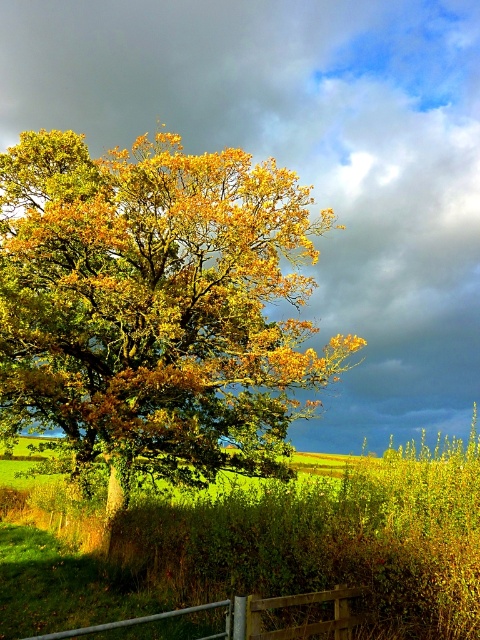
What do you see at coordinates (156, 307) in the screenshot?
I see `golden yellow leaves at center` at bounding box center [156, 307].

Which is behind, point (181, 390) or point (357, 592)?

The point (181, 390) is behind.

You are a GUI agent. You are given a task and a screenshot of the screen. Output one action in this format:
    pyautogui.click(x=<x>, y=<y>)
    Task: Click on the golden yellow leaves at center
    
    Given the screenshot: What is the action you would take?
    pyautogui.click(x=156, y=307)